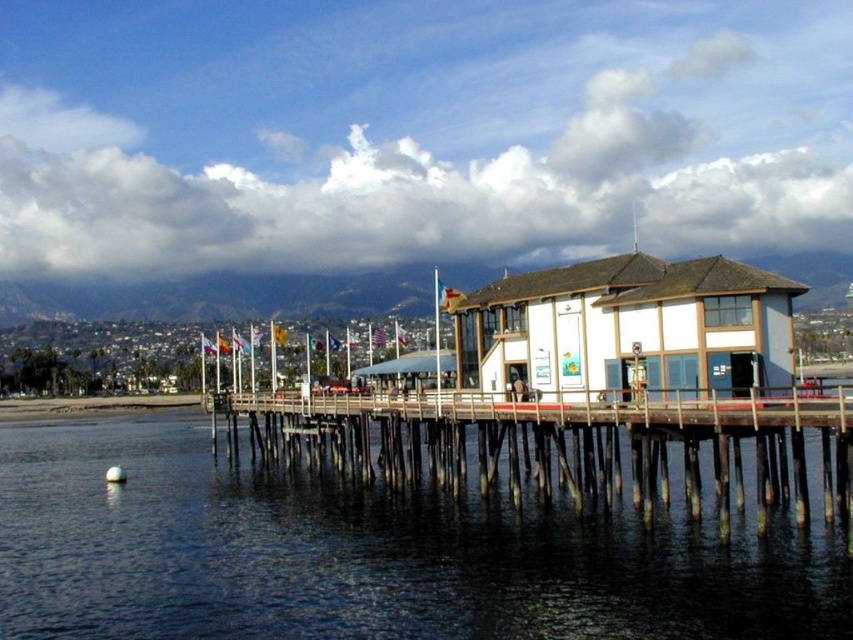
Question: Which point is farther from the camera taking this photo?

Choices:
 (A) (593, 426)
 (B) (439, 385)
 (C) (770, 602)

Answer: (B)

Question: Estimate the real-world distances between objects in this image. Which object is farther from the dark blue water at lower left?

Choices:
 (A) metallic flagpole at center
 (B) wooden at center

Answer: (A)

Question: Can you confirm if dark blue water at lower left is smaller than wooden at center?

Choices:
 (A) yes
 (B) no

Answer: (B)

Question: Is wooden at center positioned before metallic flagpole at center?

Choices:
 (A) no
 (B) yes

Answer: (B)

Question: Among these points, which one is nearest to the camera?

Choices:
 (A) (512, 477)
 (B) (473, 579)
 (C) (434, 394)

Answer: (B)

Question: Does wooden at center have a lesser width compared to metallic flagpole at center?

Choices:
 (A) no
 (B) yes

Answer: (A)